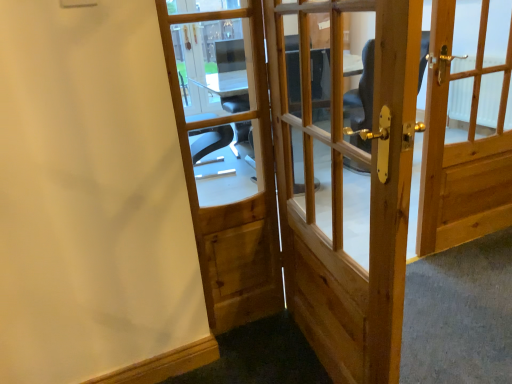
The width and height of the screenshot is (512, 384). Identify the location of free space to the left of natural wood door at center, the 2th door when ordered from right to left. (262, 363).